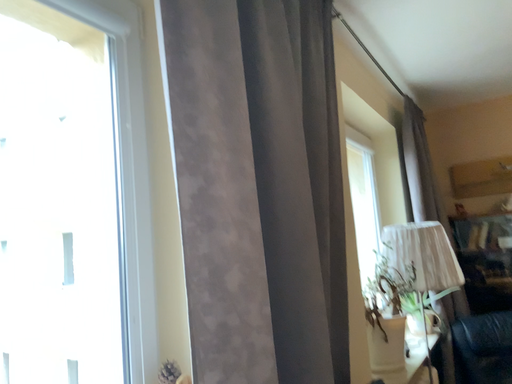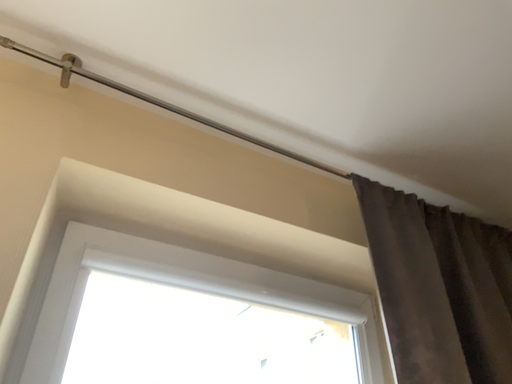
Question: Which way did the camera rotate in the video?

Choices:
 (A) rotated left
 (B) rotated right

Answer: (A)